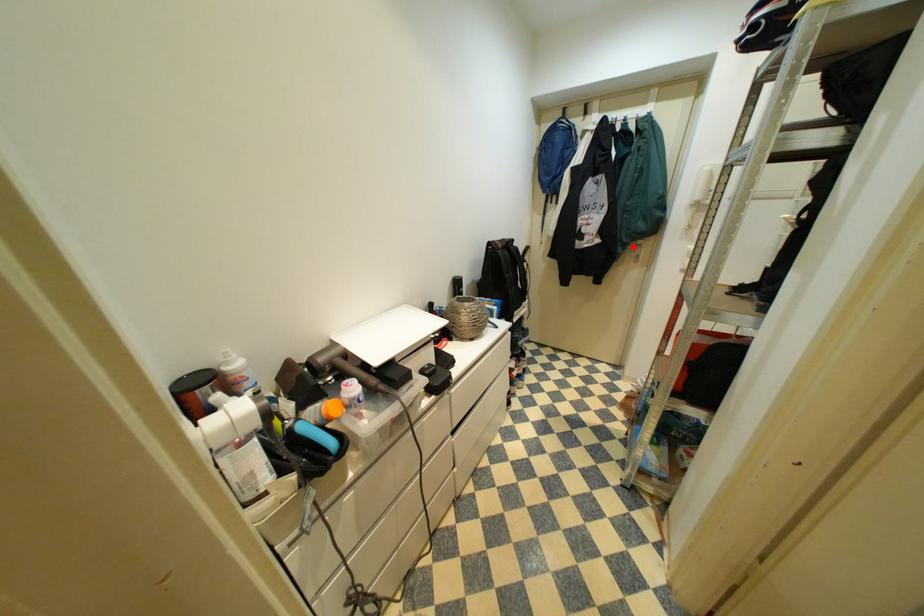
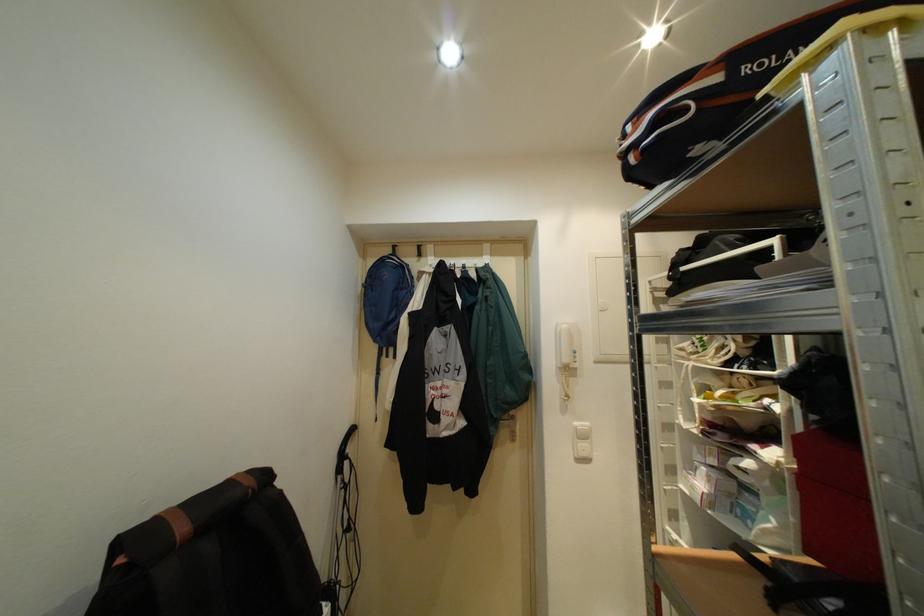
Find the pixel in the second image that matches the highlighted location in the first image.

(505, 424)